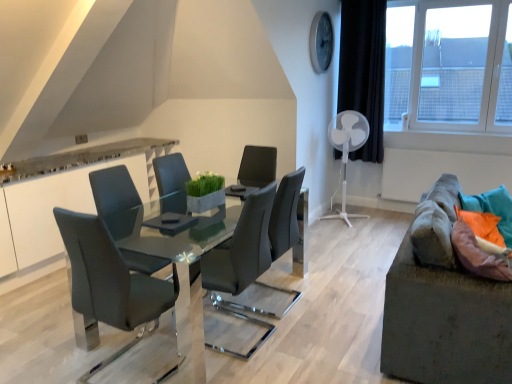
This screenshot has height=384, width=512. What do you see at coordinates (347, 149) in the screenshot? I see `white plastic mechanical fan at right` at bounding box center [347, 149].

Locate an element on the screen. This screenshot has width=512, height=384. orange fabric pillow at right is located at coordinates tap(477, 255).

Image resolution: width=512 pixels, height=384 pixels. What are the coordinates of `glossy glass table at center` in the screenshot? It's located at (152, 278).

What do you see at coordinates (110, 281) in the screenshot? This screenshot has width=512, height=384. I see `matte gray chair at left, the 1th chair positioned from the left` at bounding box center [110, 281].

The image size is (512, 384). Find the location of `black fabric curtain at upper right`. black fabric curtain at upper right is located at coordinates [362, 69].

Image resolution: width=512 pixels, height=384 pixels. What do you see at coordinates (449, 66) in the screenshot? I see `transparent glass window at upper right` at bounding box center [449, 66].

Find the location of a particular element. This screenshot has width=512, height=384. transparent glass window at upper right is located at coordinates (449, 66).

Identify the location of white plastic mechanical fan at right. (347, 149).

From the image's perspective, between black fabric curtain at upper right and matte gray chair at center, arranged as the 2th chair when viewed from the left, who is located below?

matte gray chair at center, arranged as the 2th chair when viewed from the left, appears lower in the image.

You are a GUI agent. You are given a task and a screenshot of the screen. Output one action in this format:
    pyautogui.click(x=<x>, y=<y>)
    Task: Click on the curtain behind the matte gray chair at center, the first chair in the back-to-front sequence
    
    Given the screenshot: What is the action you would take?
    pyautogui.click(x=362, y=69)

Considering the relative positions of black fabric curtain at upper right and matte gray chair at center, arranged as the 2th chair when viewed from the left, in the image provided, is black fabric curtain at upper right to the right of matte gray chair at center, arranged as the 2th chair when viewed from the left, from the viewer's perspective?

Yes, black fabric curtain at upper right is to the right of matte gray chair at center, arranged as the 2th chair when viewed from the left.

From the picture: Considering their positions, is transparent glass window at upper right located in front of or behind orange fabric pillow at right?

transparent glass window at upper right is behind orange fabric pillow at right.

Is transparent glass window at upper right shorter than orange fabric pillow at right?

In fact, transparent glass window at upper right may be taller than orange fabric pillow at right.

Could orange fabric pillow at right be considered to be inside transparent glass window at upper right?

That's incorrect, orange fabric pillow at right is not inside transparent glass window at upper right.

From the image's perspective, which object appears higher, glossy glass table at center or textured gray couch at right?

textured gray couch at right appears higher in the image.

Is glossy glass table at center outside of textured gray couch at right?

Indeed, glossy glass table at center is completely outside textured gray couch at right.

Looking at the image, does glossy glass table at center seem bigger or smaller compared to textured gray couch at right?

Considering their sizes, glossy glass table at center takes up less space than textured gray couch at right.

Consider the image. Considering the relative sizes of glossy glass table at center and transparent glass window at upper right in the image provided, is glossy glass table at center taller than transparent glass window at upper right?

Incorrect, the height of glossy glass table at center is not larger of that of transparent glass window at upper right.

Can transparent glass window at upper right be found inside glossy glass table at center?

Definitely not — transparent glass window at upper right is not inside glossy glass table at center.

Are glossy glass table at center and transparent glass window at upper right making contact?

There is a gap between glossy glass table at center and transparent glass window at upper right.

Does glossy glass table at center appear on the left side of transparent glass window at upper right?

Indeed, glossy glass table at center is positioned on the left side of transparent glass window at upper right.

Can you confirm if white plastic mechanical fan at right is shorter than textured gray couch at right?

No.

Between white plastic mechanical fan at right and textured gray couch at right, which one is positioned in front?

textured gray couch at right is more forward.

From the picture: Could you tell me if white plastic mechanical fan at right is facing textured gray couch at right?

No, white plastic mechanical fan at right is not aimed at textured gray couch at right.

From a real-world perspective, does white plastic mechanical fan at right sit lower than textured gray couch at right?

No, from a real-world perspective, white plastic mechanical fan at right is not under textured gray couch at right.

Is transparent glass window at upper right oriented towards matte gray chair at left, which is the 2th chair from back to front?

Yes, transparent glass window at upper right faces towards matte gray chair at left, which is the 2th chair from back to front.

Is transparent glass window at upper right to the right of matte gray chair at left, the 1th chair positioned from the left, from the viewer's perspective?

Correct, you'll find transparent glass window at upper right to the right of matte gray chair at left, the 1th chair positioned from the left.

Would you say transparent glass window at upper right is a long distance from matte gray chair at left, which appears as the 1th chair when viewed from the front?

Absolutely, transparent glass window at upper right is distant from matte gray chair at left, which appears as the 1th chair when viewed from the front.

Between transparent glass window at upper right and matte gray chair at left, which is the 2th chair from back to front, which one has less height?

matte gray chair at left, which is the 2th chair from back to front.

Which is nearer, (96, 297) or (59, 210)?

The point (59, 210) is closer.

From a real-world perspective, does glossy glass table at center sit lower than matte gray chair at left, the 1th chair positioned from the left?

Yes, from a real-world perspective, glossy glass table at center is below matte gray chair at left, the 1th chair positioned from the left.

From the image's perspective, between glossy glass table at center and matte gray chair at left, which appears as the 1th chair when viewed from the front, which one is located above?

glossy glass table at center appears higher in the image.

Is glossy glass table at center positioned in front of matte gray chair at left, positioned as the 2th chair in right-to-left order?

No, it is behind matte gray chair at left, positioned as the 2th chair in right-to-left order.

From the image's perspective, which chair is the 1st one below the black fabric curtain at upper right? Please provide its 2D coordinates.

[(256, 249)]

Image resolution: width=512 pixels, height=384 pixels. Find the location of `pillow below the transparent glass window at upper right (from a real-world perspective)`. pillow below the transparent glass window at upper right (from a real-world perspective) is located at coordinates (477, 255).

Estimate the real-world distances between objects in this image. Which object is further from textured gray couch at right, white plastic mechanical fan at right or matte gray chair at left, which appears as the 1th chair when viewed from the front?

The object further to textured gray couch at right is white plastic mechanical fan at right.

In the scene shown: Which object lies further to the anchor point black fabric curtain at upper right, white plastic mechanical fan at right or matte gray chair at center, the 1th chair viewed from the right?

matte gray chair at center, the 1th chair viewed from the right, is further to black fabric curtain at upper right.

Looking at the image, which one is located further to textured gray couch at right, white plastic mechanical fan at right or orange fabric pillow at right?

white plastic mechanical fan at right is positioned further to the anchor textured gray couch at right.

From the image, which object appears to be farther from transparent glass window at upper right, glossy glass table at center or black fabric curtain at upper right?

glossy glass table at center lies further to transparent glass window at upper right than the other object.

From the image, which object appears to be nearer to matte gray chair at left, the 1th chair positioned from the left, textured gray couch at right or transparent glass window at upper right?

textured gray couch at right.

Which object lies nearer to the anchor point orange fabric pillow at right, matte gray chair at left, the 1th chair positioned from the left, or transparent glass window at upper right?

Among the two, matte gray chair at left, the 1th chair positioned from the left, is located nearer to orange fabric pillow at right.

Estimate the real-world distances between objects in this image. Which object is further from matte gray chair at left, which appears as the 1th chair when viewed from the front, transparent glass window at upper right or black fabric curtain at upper right?

Based on the image, transparent glass window at upper right appears to be further to matte gray chair at left, which appears as the 1th chair when viewed from the front.

Estimate the real-world distances between objects in this image. Which object is closer to black fabric curtain at upper right, orange fabric pillow at right or matte gray chair at left, which appears as the 1th chair when viewed from the front?

Based on the image, orange fabric pillow at right appears to be nearer to black fabric curtain at upper right.

This screenshot has width=512, height=384. Find the location of `chair between matte gray chair at left, which appears as the 1th chair when viewed from the front, and transparent glass window at upper right`. chair between matte gray chair at left, which appears as the 1th chair when viewed from the front, and transparent glass window at upper right is located at coordinates (256, 249).

Locate an element on the screen. This screenshot has height=384, width=512. table between matte gray chair at left, which is the 2th chair from back to front, and textured gray couch at right from left to right is located at coordinates (152, 278).

This screenshot has width=512, height=384. What are the coordinates of `chair between matte gray chair at left, positioned as the 2th chair in right-to-left order, and orange fabric pillow at right` in the screenshot? It's located at (256, 249).

The image size is (512, 384). Find the location of `pillow located between glossy glass table at center and textured gray couch at right in the left-right direction`. pillow located between glossy glass table at center and textured gray couch at right in the left-right direction is located at coordinates (477, 255).